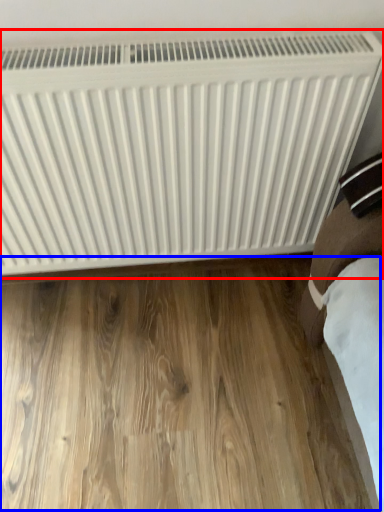
Question: Among these objects, which one is farthest to the camera, radiator (highlighted by a red box) or hardwood (highlighted by a blue box)?

Choices:
 (A) radiator
 (B) hardwood

Answer: (B)